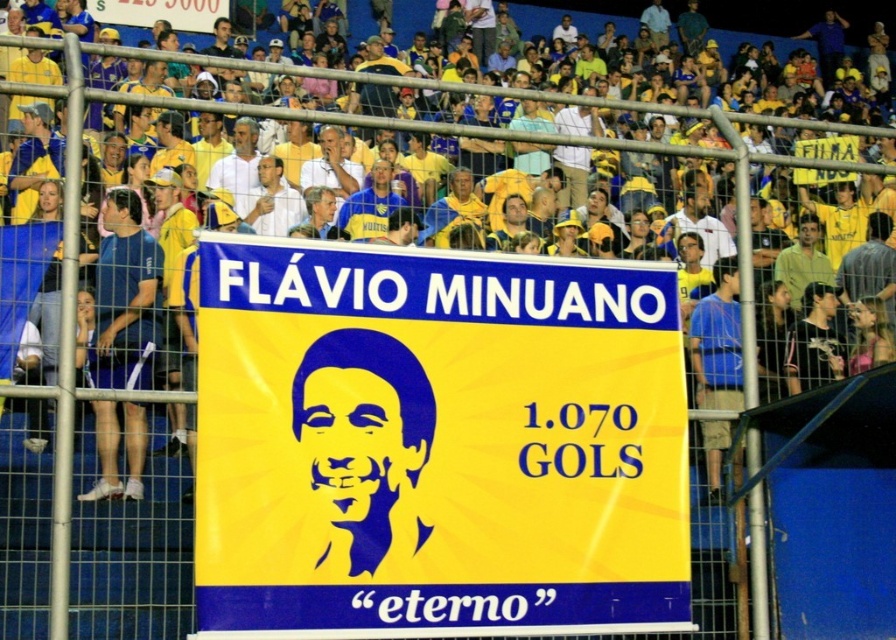
Question: Is blue fabric shirt at right further to camera compared to white matte shirt at center?

Choices:
 (A) no
 (B) yes

Answer: (A)

Question: Among these objects, which one is farthest from the camera?

Choices:
 (A) blue fabric shirt at left
 (B) blue fabric shirt at right
 (C) white matte shirt at center

Answer: (C)

Question: Is light blue shirt at center above blue jersey at center?

Choices:
 (A) no
 (B) yes

Answer: (B)

Question: Does blue fabric shirt at left have a greater width compared to white shirt at center?

Choices:
 (A) no
 (B) yes

Answer: (A)

Question: Which point is closer to the camera?

Choices:
 (A) (390, 442)
 (B) (566, 205)

Answer: (A)

Question: Which object is farther from the camera taking this photo?

Choices:
 (A) blue fabric shirt at right
 (B) white shirt at center
 (C) light blue shirt at center

Answer: (C)